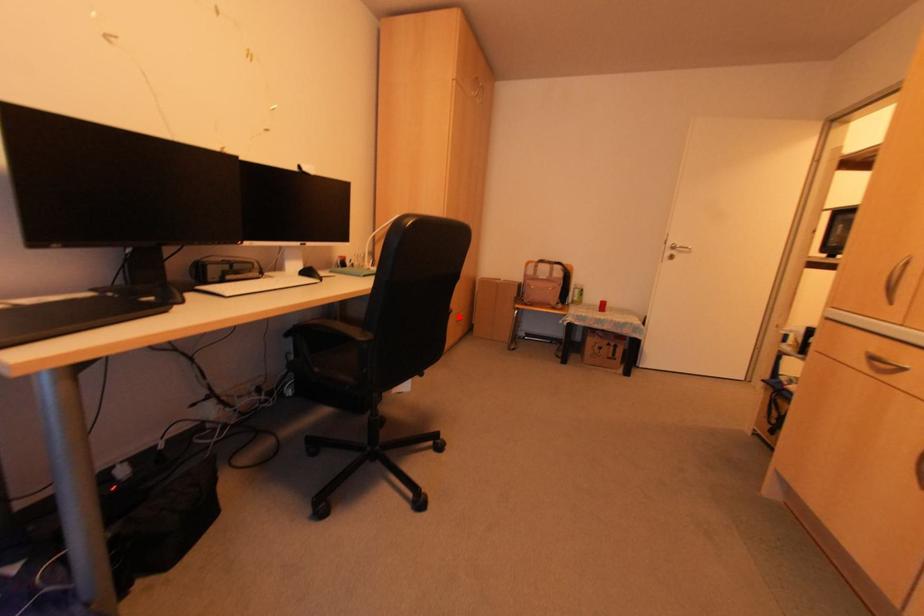
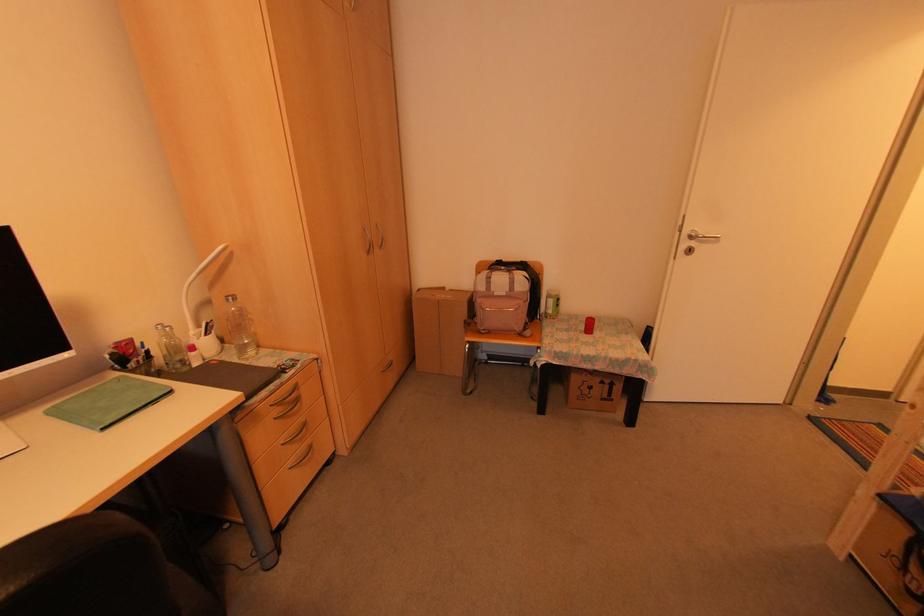
Question: I am providing you with two images of the same scene from different viewpoints. In image1, a red point is highlighted. Considering the same 3D point in image2, which of the following is correct?

Choices:
 (A) It is closer
 (B) It is farther

Answer: (A)